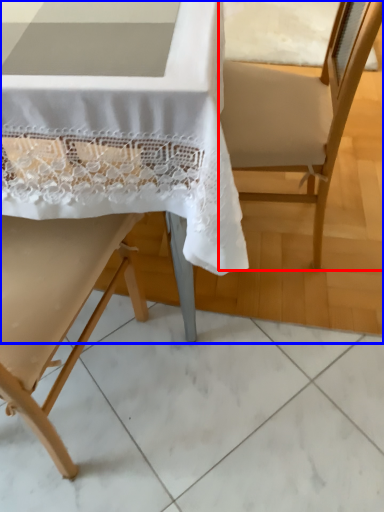
Question: Which point is closer to the camera, armchair (highlighted by a red box) or chair (highlighted by a blue box)?

Choices:
 (A) armchair
 (B) chair

Answer: (B)